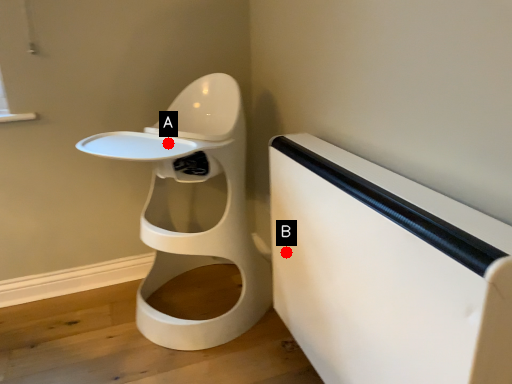
Question: Two points are circled on the image, labeled by A and B beside each circle. Which of the following is the closest to the observer?

Choices:
 (A) A is closer
 (B) B is closer

Answer: (B)